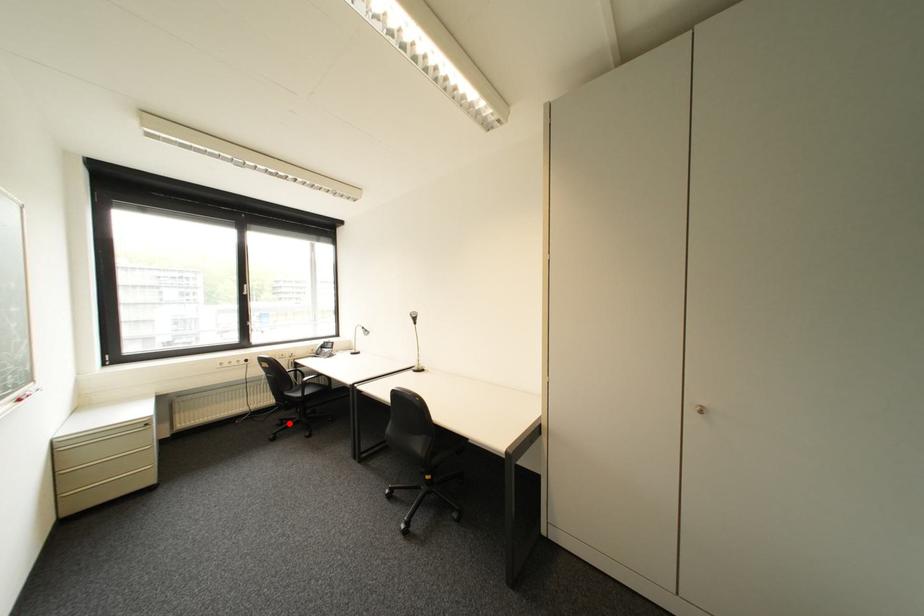
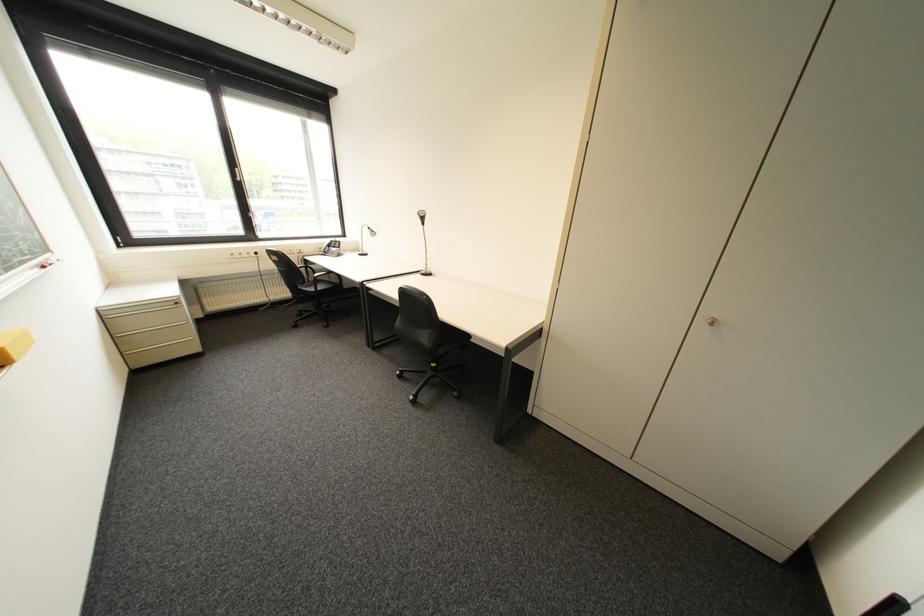
Question: A red point is marked in image1. In image2, is the corresponding 3D point closer to the camera or farther? Reply with the corresponding letter.

Choices:
 (A) The corresponding 3D point is closer.
 (B) The corresponding 3D point is farther.

Answer: (A)